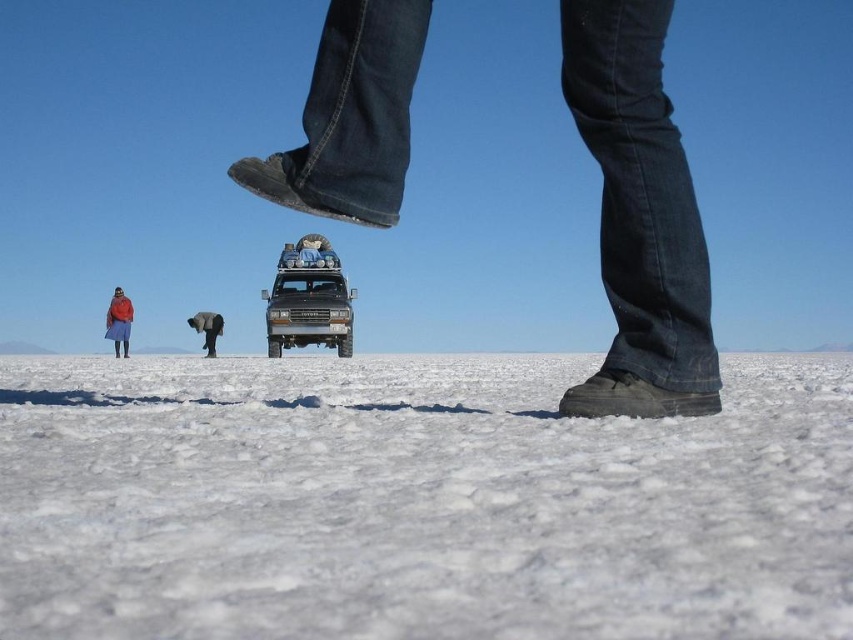
You are planning to take a photo from above the matte black jeep at center and the smooth gray elephant at center. Which object will appear wider in the photo?

The smooth gray elephant at center will appear wider in the photo because its width is greater than the matte black jeep at center.

You are standing on the white crystalline snow at lower center and want to walk towards the smooth gray elephant at center. Which direction should you move?

You should move to the left because the white crystalline snow at lower center is to the right of the smooth gray elephant at center, so moving left will bring you closer to the elephant.

You are standing on the salt flats and see two points marked on the ground. Which point is closer to you, point (196, 365) or point (215, 340)?

Point (196, 365) is closer to you than point (215, 340).